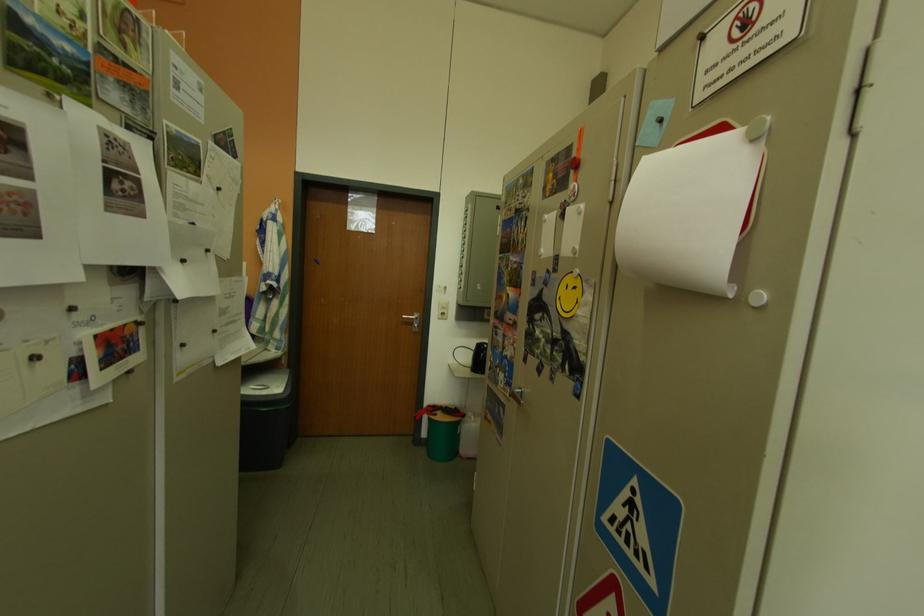
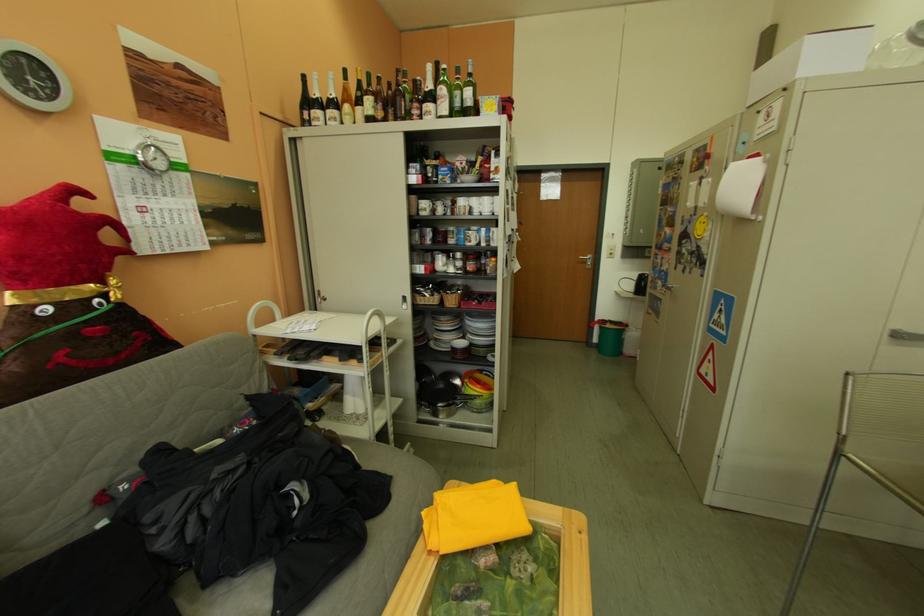
Find the pixel in the second image that matches point (442, 421) in the first image.

(613, 330)